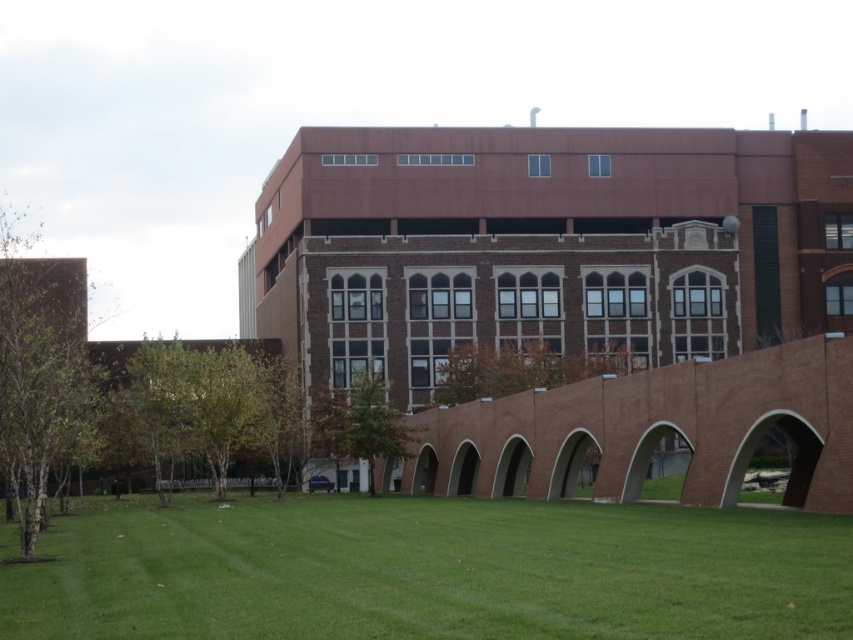
Does green grass at lower center have a smaller size compared to green leafy tree at left?

Yes, green grass at lower center is smaller than green leafy tree at left.

Who is taller, green grass at lower center or green leafy tree at left?

With more height is green leafy tree at left.

What do you see at coordinates (432, 572) in the screenshot?
I see `green grass at lower center` at bounding box center [432, 572].

The width and height of the screenshot is (853, 640). Find the location of `green grass at lower center`. green grass at lower center is located at coordinates (432, 572).

Which is behind, point (590, 557) or point (397, 436)?

The point (397, 436) is behind.

Does green grass at lower center have a greater height compared to green leafy tree at center?

No.

Who is more distant from viewer, (x=474, y=588) or (x=321, y=429)?

Positioned behind is point (x=321, y=429).

Identify the location of green grass at lower center. (432, 572).

Between green leafy tree at left and green leafy tree at center, which one appears on the right side from the viewer's perspective?

Positioned to the right is green leafy tree at center.

Can you confirm if green leafy tree at left is bigger than green leafy tree at center?

Yes.

Between point (0, 275) and point (328, 445), which one is positioned behind?

Positioned behind is point (328, 445).

Locate an element on the screen. This screenshot has width=853, height=640. green leafy tree at left is located at coordinates (38, 368).